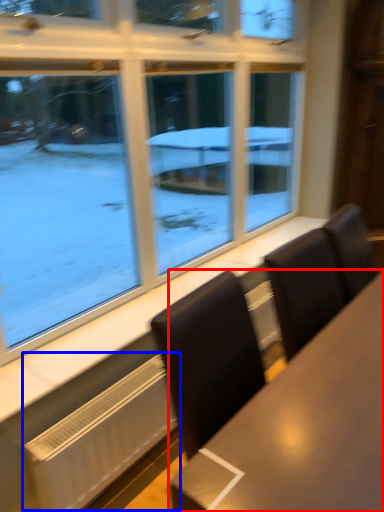
Question: Which object appears closest to the camera in this image, table (highlighted by a red box) or radiator (highlighted by a blue box)?

Choices:
 (A) table
 (B) radiator

Answer: (A)